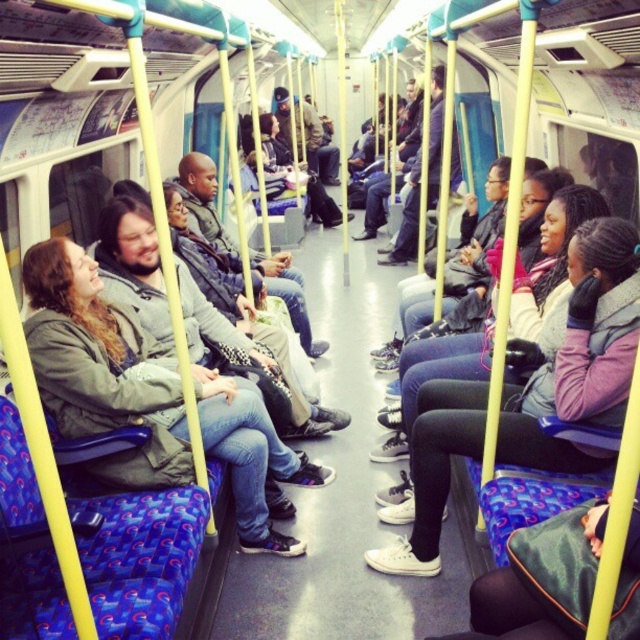
You are a passenger on the subway train and want to know if the green fabric jacket at left is directly in front of the white matte sneakers at center. Based on the scene description, can you confirm this?

The green fabric jacket at left is positioned under the white matte sneakers at center, so it is directly in front of them from the perspective of someone looking at the scene.

You are standing on the subway train and see the point marked at coordinates [100,365]. What object is located at that point?

The point at coordinates [100,365] corresponds to the green fabric jacket at left.

You are a delivery person carrying a box that measures 1.2 meters in length. You need to place it between the green fabric jacket at left and the white matte sneakers at center on the subway train. Will the box fit in that space?

The green fabric jacket at left is 1.21 meters away from the white matte sneakers at center. Since the box is 1.2 meters long, it will fit in the space between them because the distance is slightly longer than the box.